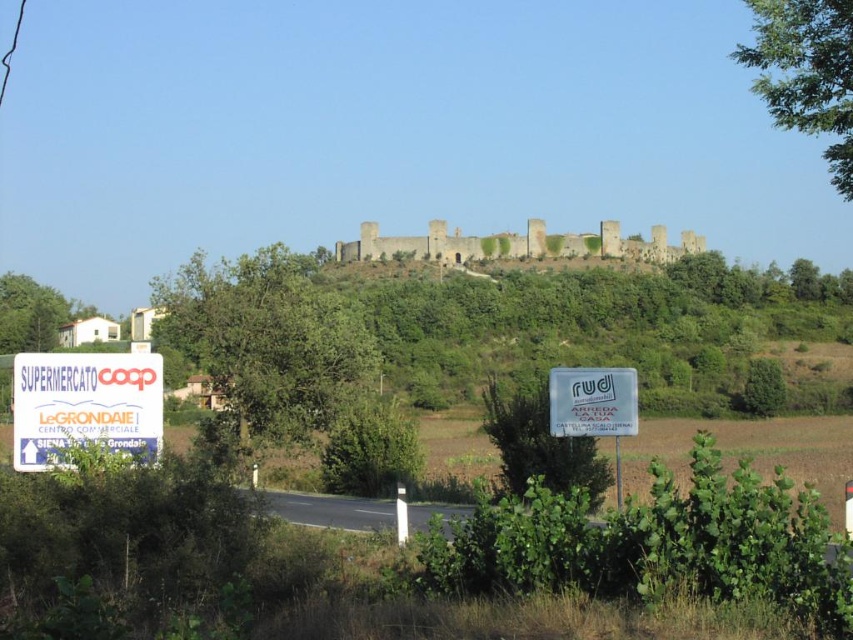
You are driving along a road in the countryside and see the white plastic sign at lower left. If you continue straight ahead, which direction will you be heading relative to the large ancient stone structure on the hill?

The white plastic sign at lower left is located at point (85, 404), so continuing straight ahead along the road will lead you directly towards the large ancient stone structure on the hill.